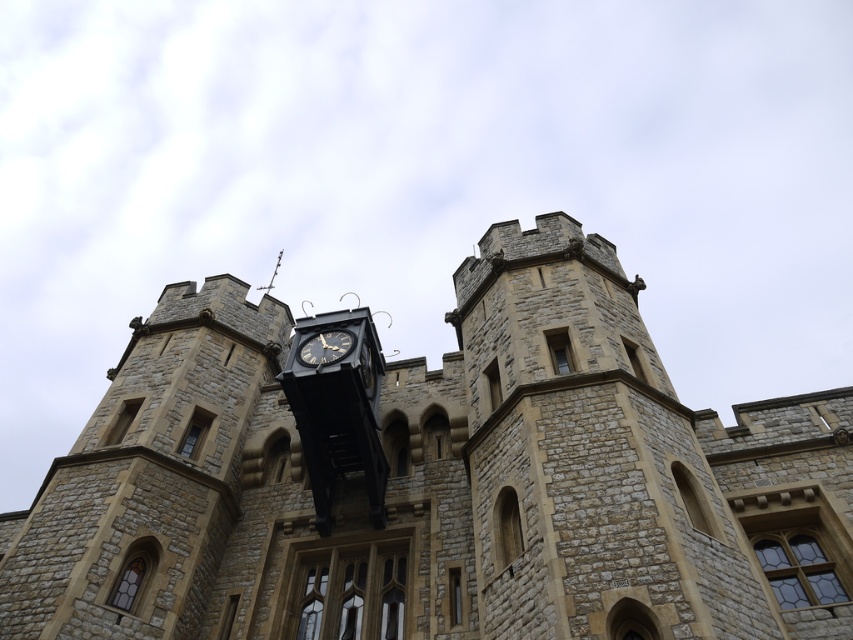
You are a stonemason tasked with repairing the stone clock tower at center and the black metal clock at center. Which structure requires you to work at a higher elevation?

The stone clock tower at center has a greater height compared to the black metal clock at center, so you will need to work at a higher elevation when repairing the stone clock tower at center.

You are standing in front of the historic stone building and want to take a photo of both the stone clock tower at center and the black metal clock at center. Which one should you position to the left side of your camera frame to include both in the photo?

To include both the stone clock tower at center and the black metal clock at center in your photo, you should position the black metal clock at center on the left side of your camera frame since the stone clock tower at center is to the right of it.